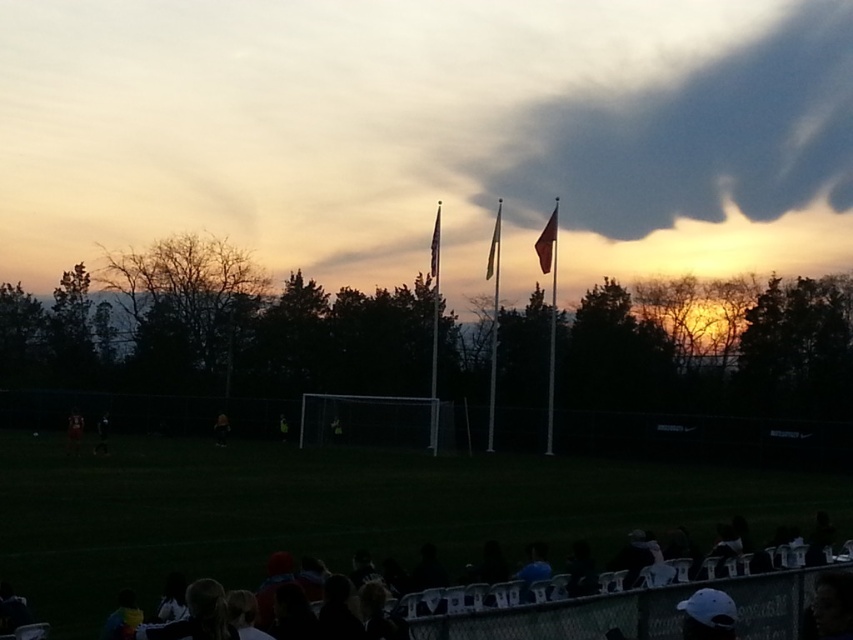
Question: Which object appears farthest from the camera in this image?

Choices:
 (A) dark green jersey at left
 (B) green fabric flag pole at center
 (C) metallic silver flag pole at center

Answer: (B)

Question: Is metallic silver flag pole at center smaller than dark gray uniform at center?

Choices:
 (A) no
 (B) yes

Answer: (A)

Question: Which object appears closest to the camera in this image?

Choices:
 (A) dark gray cloud at upper center
 (B) white fabric flag at center

Answer: (B)

Question: Estimate the real-world distances between objects in this image. Which object is farther from the dark green jersey at left?

Choices:
 (A) green fabric flag pole at center
 (B) silky white flag at center

Answer: (B)

Question: Does dark gray cloud at upper center appear on the right side of dark gray uniform at center?

Choices:
 (A) yes
 (B) no

Answer: (A)

Question: Does dark gray cloud at upper center have a smaller size compared to dark green jersey at left?

Choices:
 (A) no
 (B) yes

Answer: (A)